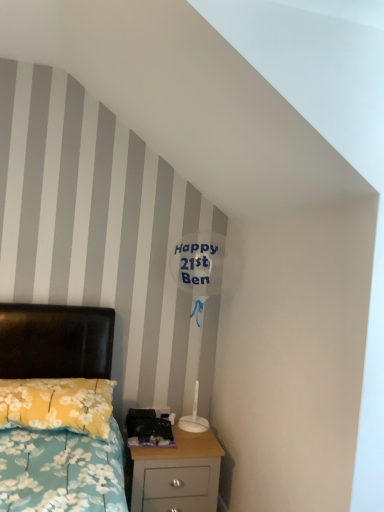
Question: Is the depth of light wood nightstand at lower right less than that of yellow floral fabric pillow at lower left?

Choices:
 (A) yes
 (B) no

Answer: (B)

Question: Are light wood nightstand at lower right and yellow floral fabric pillow at lower left beside each other?

Choices:
 (A) no
 (B) yes

Answer: (A)

Question: Is yellow floral fabric pillow at lower left surrounded by light wood nightstand at lower right?

Choices:
 (A) no
 (B) yes

Answer: (A)

Question: Is light wood nightstand at lower right facing towards yellow floral fabric pillow at lower left?

Choices:
 (A) yes
 (B) no

Answer: (B)

Question: Is the depth of light wood nightstand at lower right greater than that of yellow floral fabric pillow at lower left?

Choices:
 (A) no
 (B) yes

Answer: (B)

Question: In terms of width, does yellow floral fabric pillow at lower left look wider or thinner when compared to light wood nightstand at lower right?

Choices:
 (A) wide
 (B) thin

Answer: (A)

Question: From the image's perspective, is yellow floral fabric pillow at lower left above or below light wood nightstand at lower right?

Choices:
 (A) above
 (B) below

Answer: (A)

Question: From a real-world perspective, is yellow floral fabric pillow at lower left physically located above or below light wood nightstand at lower right?

Choices:
 (A) above
 (B) below

Answer: (A)

Question: In the image, is yellow floral fabric pillow at lower left positioned in front of or behind light wood nightstand at lower right?

Choices:
 (A) behind
 (B) front

Answer: (B)

Question: Considering the positions of light wood nightstand at lower right and transparent plastic balloon at upper center in the image, is light wood nightstand at lower right bigger or smaller than transparent plastic balloon at upper center?

Choices:
 (A) big
 (B) small

Answer: (A)

Question: From a real-world perspective, is light wood nightstand at lower right above or below transparent plastic balloon at upper center?

Choices:
 (A) below
 (B) above

Answer: (A)

Question: From their relative heights in the image, would you say light wood nightstand at lower right is taller or shorter than transparent plastic balloon at upper center?

Choices:
 (A) short
 (B) tall

Answer: (A)

Question: Is light wood nightstand at lower right to the left or to the right of transparent plastic balloon at upper center in the image?

Choices:
 (A) left
 (B) right

Answer: (A)

Question: Is light wood nightstand at lower right in front of or behind yellow floral fabric pillow at lower left in the image?

Choices:
 (A) front
 (B) behind

Answer: (B)

Question: Based on their sizes in the image, would you say light wood nightstand at lower right is bigger or smaller than yellow floral fabric pillow at lower left?

Choices:
 (A) small
 (B) big

Answer: (B)